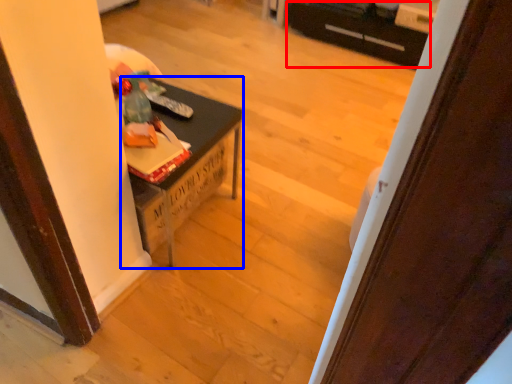
Question: Among these objects, which one is nearest to the camera, drawer (highlighted by a red box) or table (highlighted by a blue box)?

Choices:
 (A) drawer
 (B) table

Answer: (B)